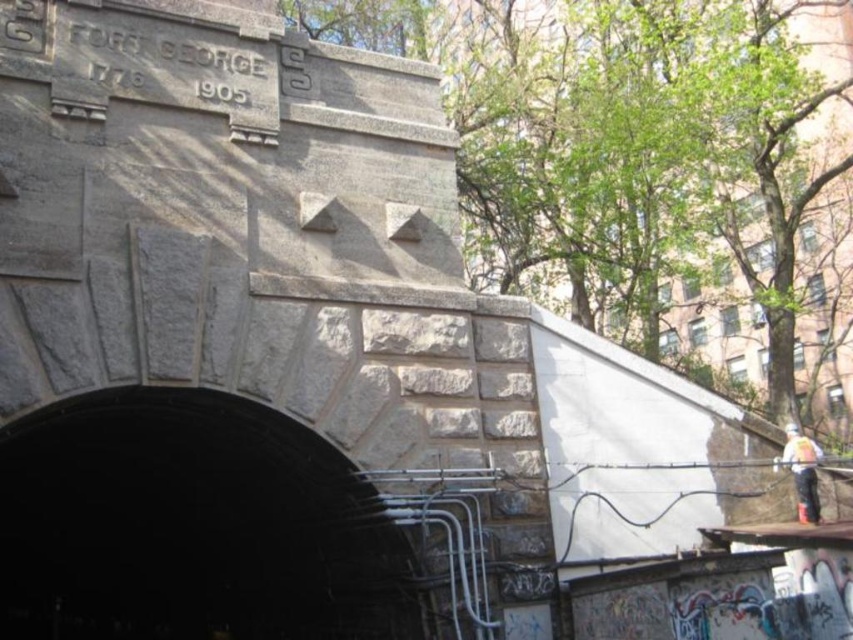
The width and height of the screenshot is (853, 640). Describe the element at coordinates (190, 525) in the screenshot. I see `dark gray stone tunnel at center` at that location.

What do you see at coordinates (190, 525) in the screenshot?
I see `dark gray stone tunnel at center` at bounding box center [190, 525].

Locate an element on the screen. The height and width of the screenshot is (640, 853). dark gray stone tunnel at center is located at coordinates (190, 525).